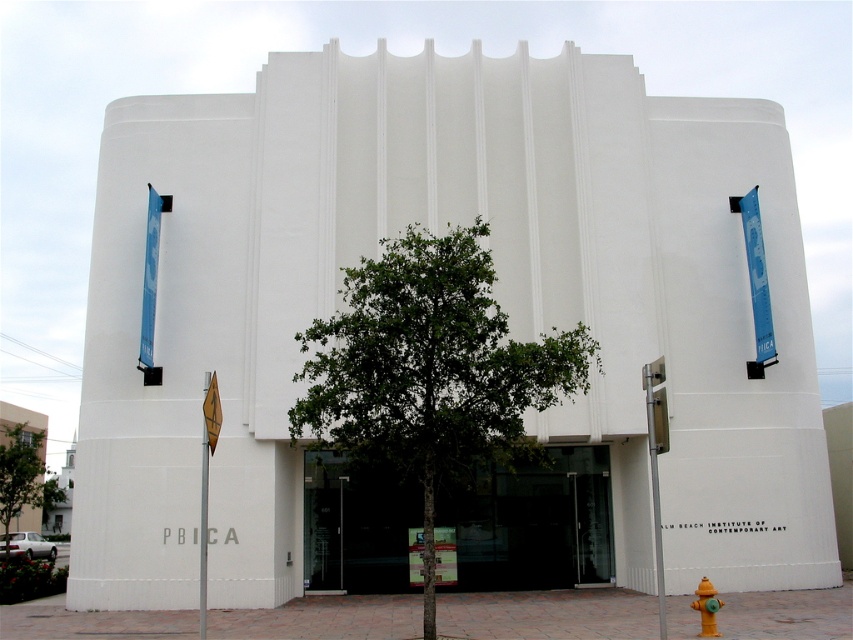
Which is more to the right, green leafy tree at center or green leafy tree at left?

green leafy tree at center

In the scene shown: Measure the distance between point (x=583, y=330) and camera.

Point (x=583, y=330) and camera are 11.35 meters apart.

This screenshot has width=853, height=640. Identify the location of green leafy tree at center. (431, 372).

Between transparent glass doors at center and green leafy tree at left, which one is positioned lower?

green leafy tree at left is lower down.

The width and height of the screenshot is (853, 640). Identify the location of transparent glass doors at center. (529, 524).

The width and height of the screenshot is (853, 640). I want to click on transparent glass doors at center, so click(x=529, y=524).

Can you confirm if transparent glass doors at center is smaller than yellow matte hydrant at lower right?

No.

Which is in front, point (500, 467) or point (718, 600)?

Positioned in front is point (718, 600).

This screenshot has height=640, width=853. Find the location of `transparent glass doors at center`. transparent glass doors at center is located at coordinates (529, 524).